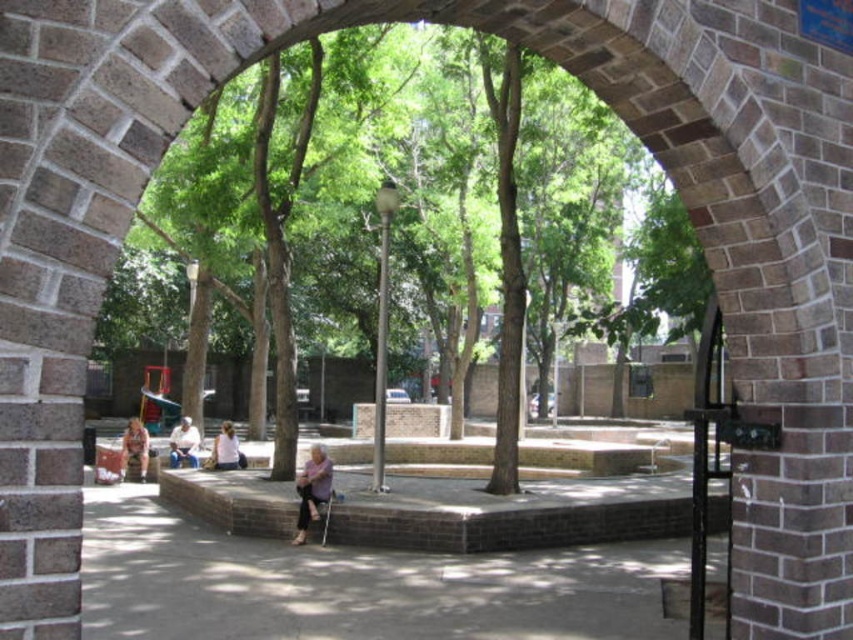
Question: Is purple fabric at center positioned in front of brown leather jacket at lower left?

Choices:
 (A) no
 (B) yes

Answer: (B)

Question: Which point appears closest to the camera in this image?

Choices:
 (A) (172, 456)
 (B) (141, 428)
 (C) (239, 451)

Answer: (B)

Question: Which object is the closest to the light purple fabric shirt at center?

Choices:
 (A) purple fabric at center
 (B) brown leather jacket at lower left
 (C) light brown leather jacket at center

Answer: (C)

Question: Which object is farther from the camera taking this photo?

Choices:
 (A) light purple fabric shirt at center
 (B) light brown leather jacket at center

Answer: (B)

Question: Can you confirm if brown leather jacket at lower left is bigger than light brown leather jacket at center?

Choices:
 (A) no
 (B) yes

Answer: (B)

Question: Is purple fabric at center to the left of light purple fabric shirt at center from the viewer's perspective?

Choices:
 (A) yes
 (B) no

Answer: (B)